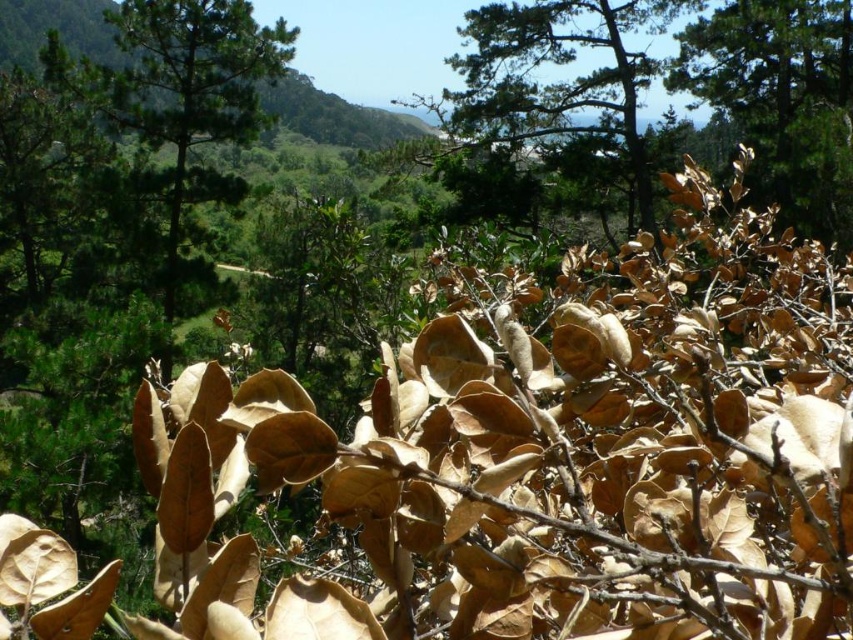
You are an environmental scientist assessing the biodiversity of this landscape. You observe the green textured pine tree at upper center and the brown matte leaves at upper right. Which of these two features would you prioritize for further study to understand the local ecosystem health, and why?

The green textured pine tree at upper center should be prioritized because it has a larger size compared to the brown matte leaves at upper right, indicating it might be a dominant species in the ecosystem, which is crucial for understanding overall health.

You are standing in the natural landscape described. You need to locate the green textured pine tree at upper center. According to the coordinates provided, where exactly should you look?

The green textured pine tree at upper center is located at point (x=548, y=115).